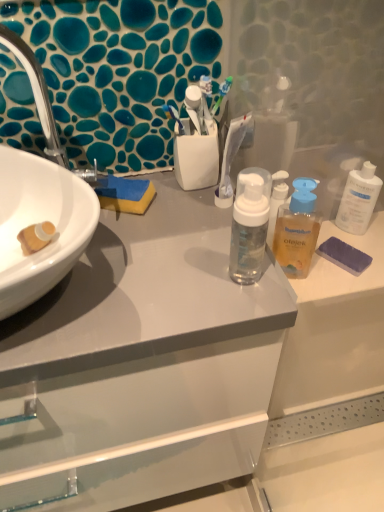
Identify the location of vacant area that is situated to the right of matte white sink at left. Image resolution: width=384 pixels, height=512 pixels. (148, 231).